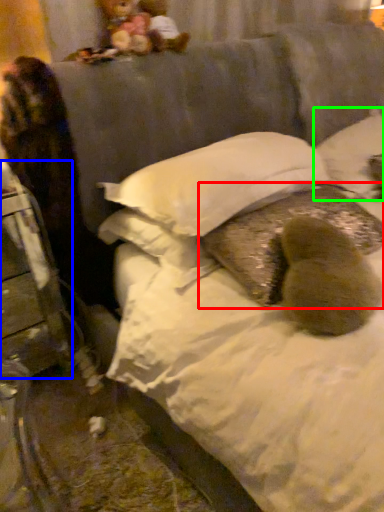
Question: Considering the real-world distances, which object is farthest from pillow (highlighted by a red box)? furniture (highlighted by a blue box) or pillow (highlighted by a green box)?

Choices:
 (A) furniture
 (B) pillow

Answer: (A)